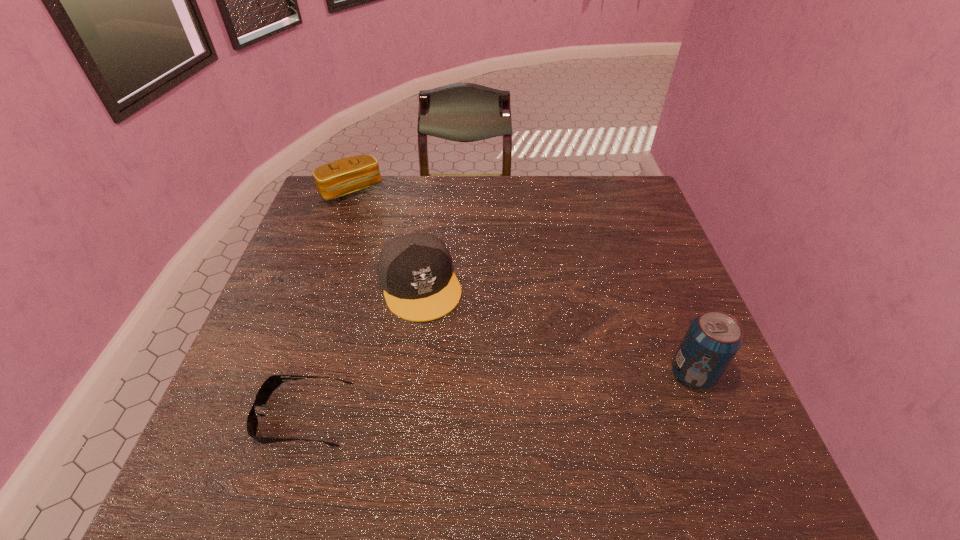
Where is `free space on the desktop that is between the sunglasses and the rightmost object and is positioned on the front-facing side of the second object from right to left`? The height and width of the screenshot is (540, 960). free space on the desktop that is between the sunglasses and the rightmost object and is positioned on the front-facing side of the second object from right to left is located at coordinates (468, 397).

Where is `vacant spot on the desktop that is between the shortest object and the rightmost object and is positioned on the zipper side of the farthest object`? vacant spot on the desktop that is between the shortest object and the rightmost object and is positioned on the zipper side of the farthest object is located at coordinates (478, 396).